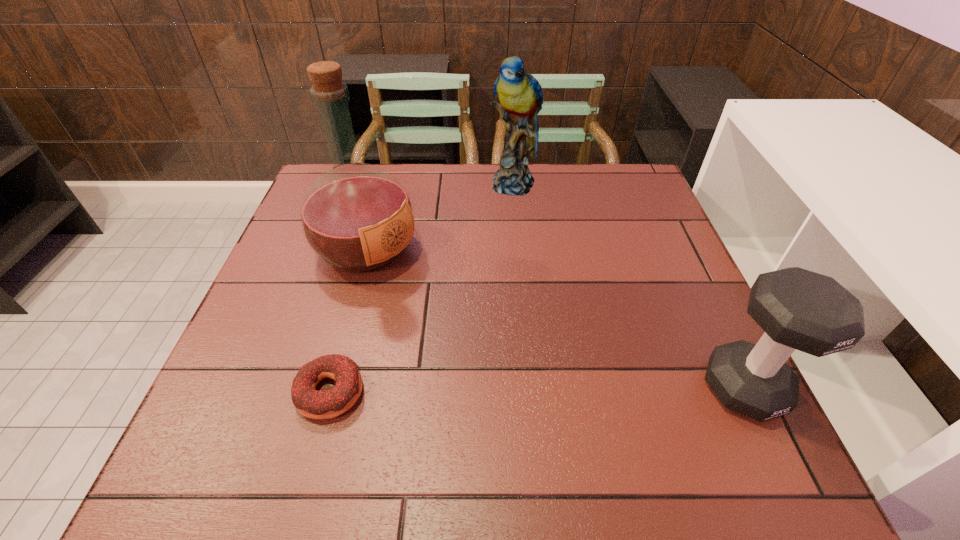
Locate an element on the screen. doughnut is located at coordinates (311, 403).

You are a GUI agent. You are given a task and a screenshot of the screen. Output one action in this format:
    pyautogui.click(x=<x>, y=<y>)
    Task: Click on the dumbbell
    This screenshot has width=960, height=540.
    Given the screenshot: What is the action you would take?
    pyautogui.click(x=798, y=309)

Where is `the third tallest object`? The image size is (960, 540). the third tallest object is located at coordinates (798, 309).

In order to click on the second farthest object in this screenshot , I will do `click(356, 217)`.

Find the location of a particular element. This screenshot has width=960, height=540. parrot is located at coordinates (519, 95).

I want to click on the third object from left to right, so click(x=519, y=95).

Locate an element on the screen. free space located 0.130m on the right of the shortest object is located at coordinates (433, 392).

Where is `vacant space located on the left of the third tallest object`? This screenshot has height=540, width=960. vacant space located on the left of the third tallest object is located at coordinates (555, 388).

I want to click on free region located on the front label of the liquor, so click(450, 302).

Locate an element on the screen. Image resolution: width=960 pixels, height=540 pixels. vacant space located 0.390m on the front label of the liquor is located at coordinates (541, 357).